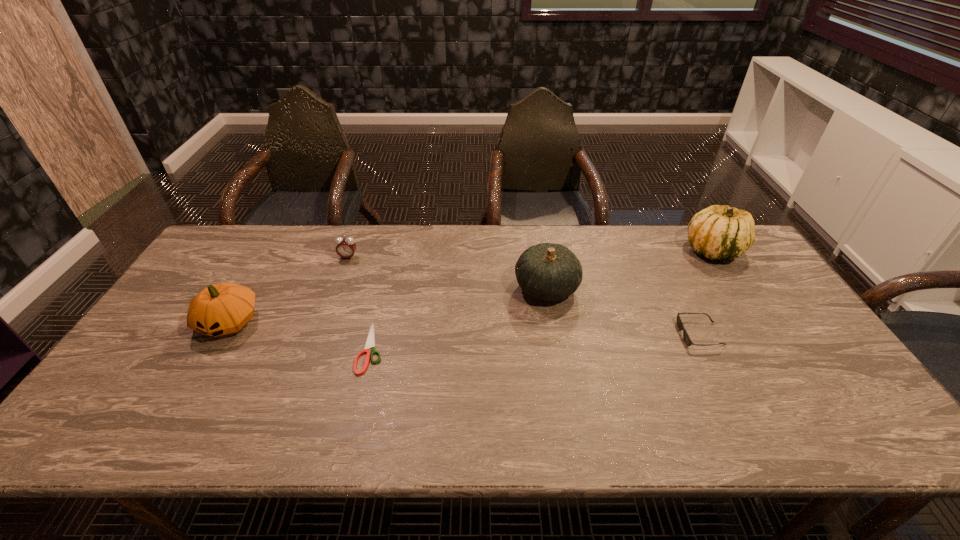
This screenshot has height=540, width=960. I want to click on the rightmost object, so click(718, 232).

At what (x,y) coordinates should I click in order to perform the action: click on the third object from right to left. Please return your answer as a coordinate pair (x, y). Looking at the image, I should click on (550, 272).

Find the location of `the leftmost gourd`. the leftmost gourd is located at coordinates (224, 308).

Find the location of a particular element. the fifth object from right to left is located at coordinates (346, 247).

The width and height of the screenshot is (960, 540). I want to click on the third shortest object, so click(346, 247).

At what (x,y) coordinates should I click in order to perform the action: click on the fifth tallest object. Please return your answer as a coordinate pair (x, y). This screenshot has width=960, height=540. Looking at the image, I should click on (687, 339).

Locate an element on the screen. This screenshot has width=960, height=540. the fifth object from left to right is located at coordinates (687, 339).

Where is `the shortest object`? This screenshot has height=540, width=960. the shortest object is located at coordinates (370, 343).

You are a GUI agent. You are given a task and a screenshot of the screen. Output one action in this format:
    pyautogui.click(x=<x>, y=<y>)
    Task: Click on the third object from left to right
    
    Given the screenshot: What is the action you would take?
    (370, 343)

Locate an element on the screen. blank space located on the front of the rightmost object is located at coordinates (766, 330).